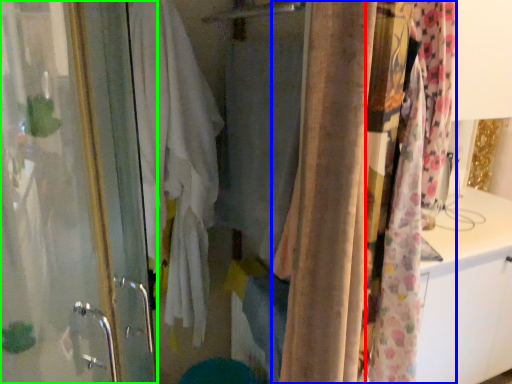
Question: Estimate the real-world distances between objects in this image. Which object is farther from curtain (highlighted by a red box), curtain (highlighted by a blue box) or screen door (highlighted by a green box)?

Choices:
 (A) curtain
 (B) screen door

Answer: (B)